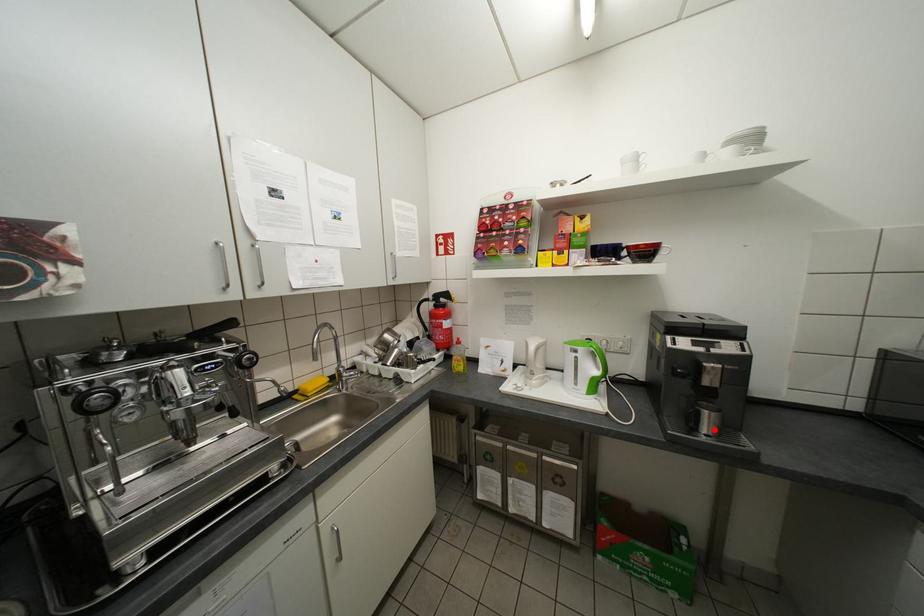
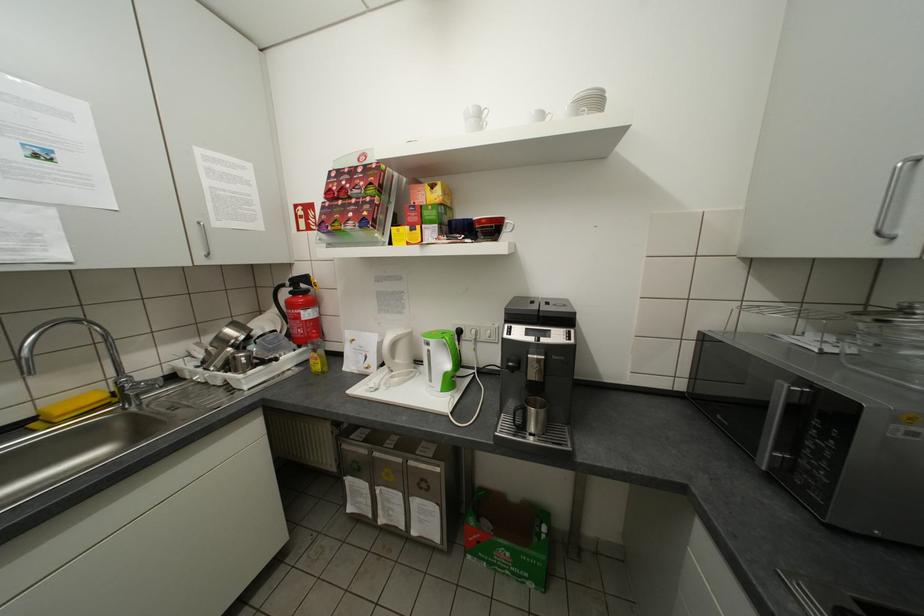
The point at the highlighted location is marked in the first image. Where is the corresponding point in the second image?

(541, 428)